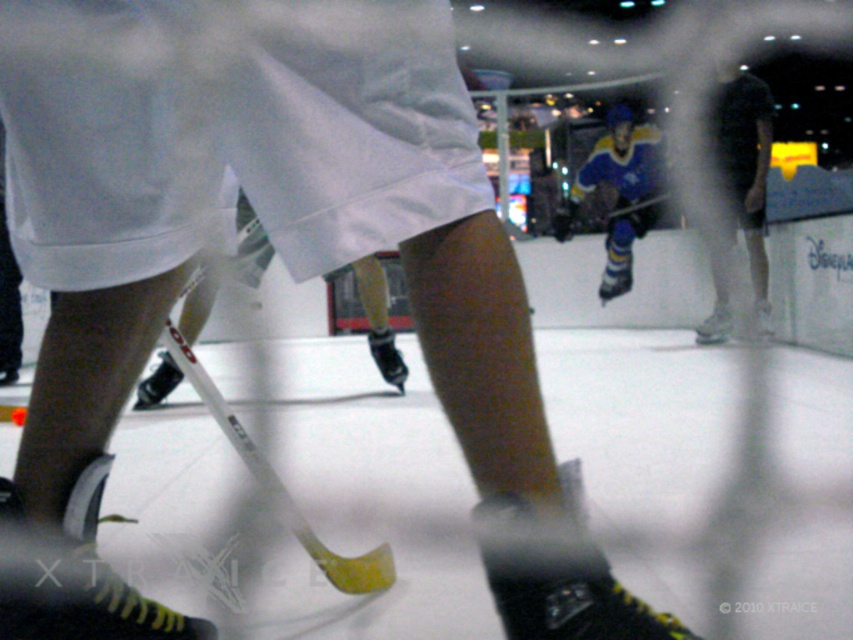
Does point (732, 122) come closer to viewer compared to point (616, 276)?

That is True.

Can you confirm if dark blue jersey at upper center is shorter than blue/yellow jersey at center?

Incorrect, dark blue jersey at upper center's height does not fall short of blue/yellow jersey at center's.

Who is more distant from viewer, [759,243] or [595,172]?

The point [595,172] is behind.

Identify the location of dark blue jersey at upper center. [x=746, y=166].